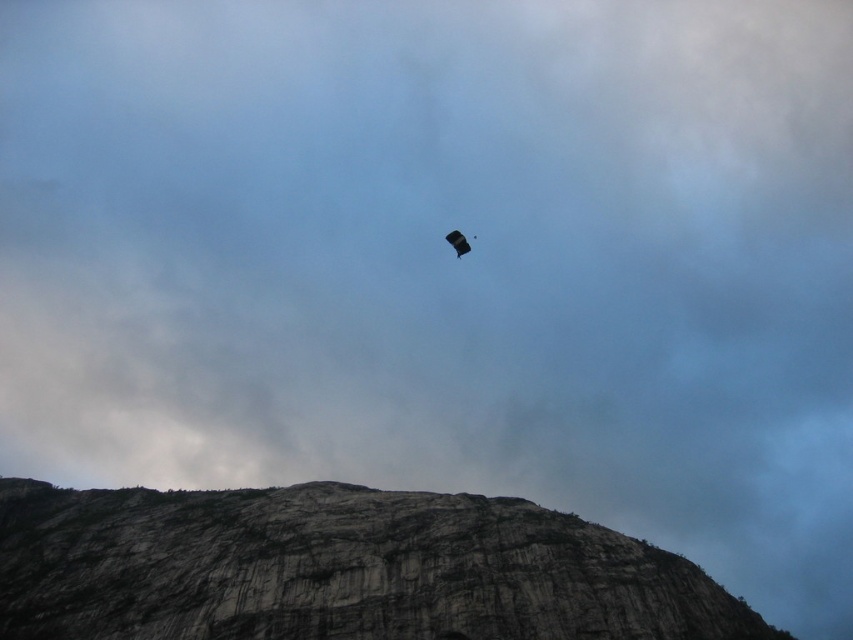
Question: Which object is farther from the camera taking this photo?

Choices:
 (A) matte black parachute at center
 (B) gray rock formation at center

Answer: (A)

Question: Which of the following is the farthest from the observer?

Choices:
 (A) (454, 243)
 (B) (675, 572)

Answer: (A)

Question: Is gray rock formation at center wider than matte black parachute at center?

Choices:
 (A) yes
 (B) no

Answer: (A)

Question: Is gray rock formation at center above matte black parachute at center?

Choices:
 (A) yes
 (B) no

Answer: (B)

Question: Does gray rock formation at center appear over matte black parachute at center?

Choices:
 (A) yes
 (B) no

Answer: (B)